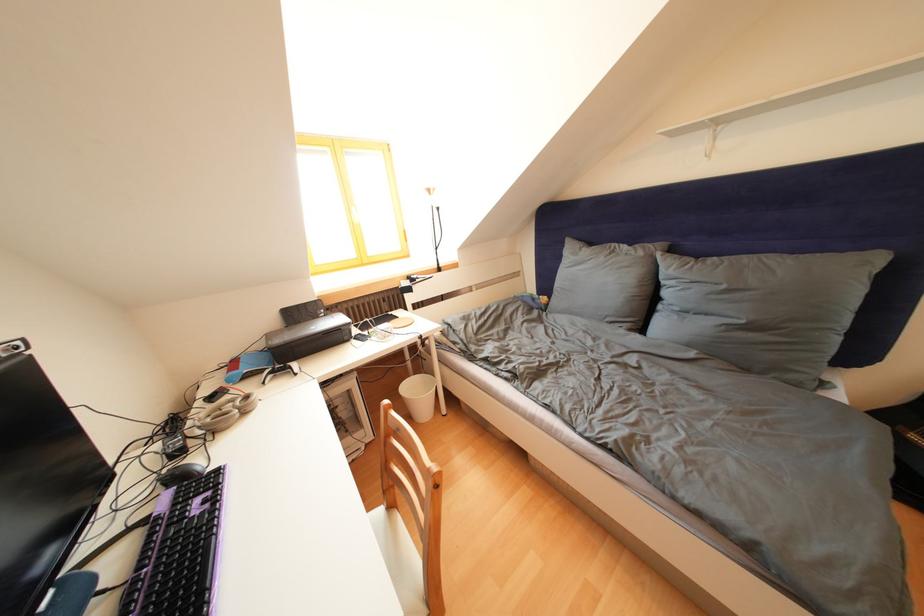
This screenshot has width=924, height=616. Describe the element at coordinates (398, 557) in the screenshot. I see `a chair sitting surface` at that location.